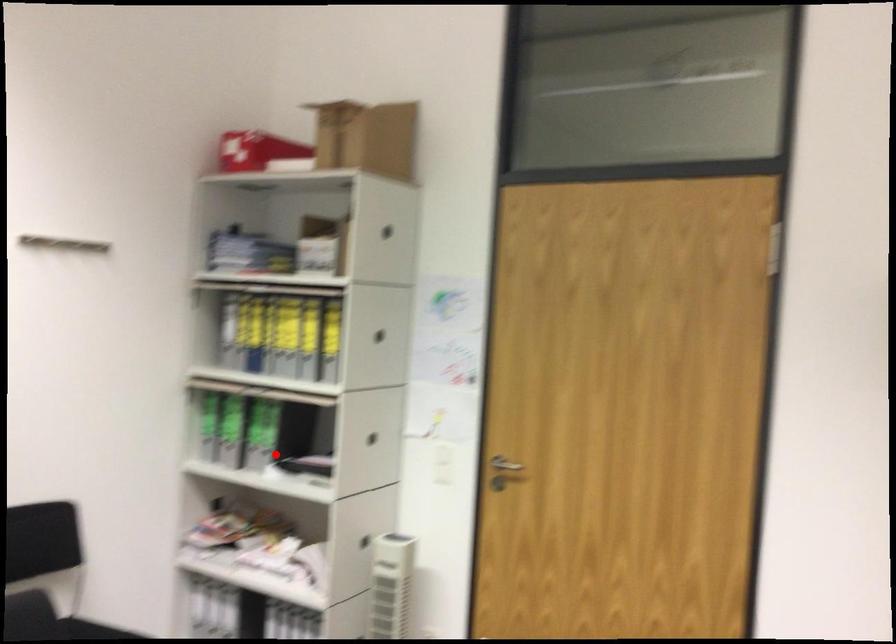
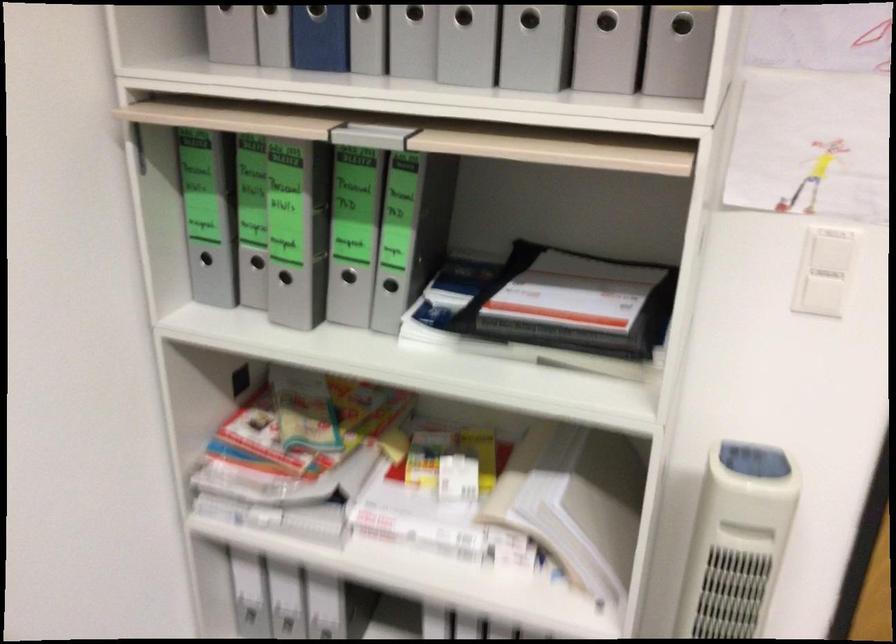
Question: A red point is marked in image1. In image2, is the corresponding 3D point closer to the camera or farther? Reply with the corresponding letter.

Choices:
 (A) The corresponding 3D point is closer.
 (B) The corresponding 3D point is farther.

Answer: (A)